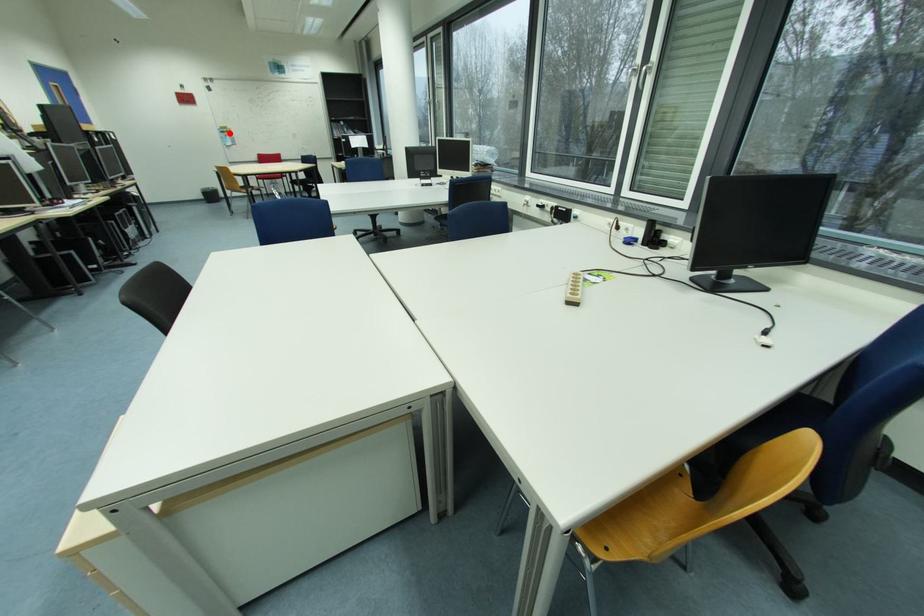
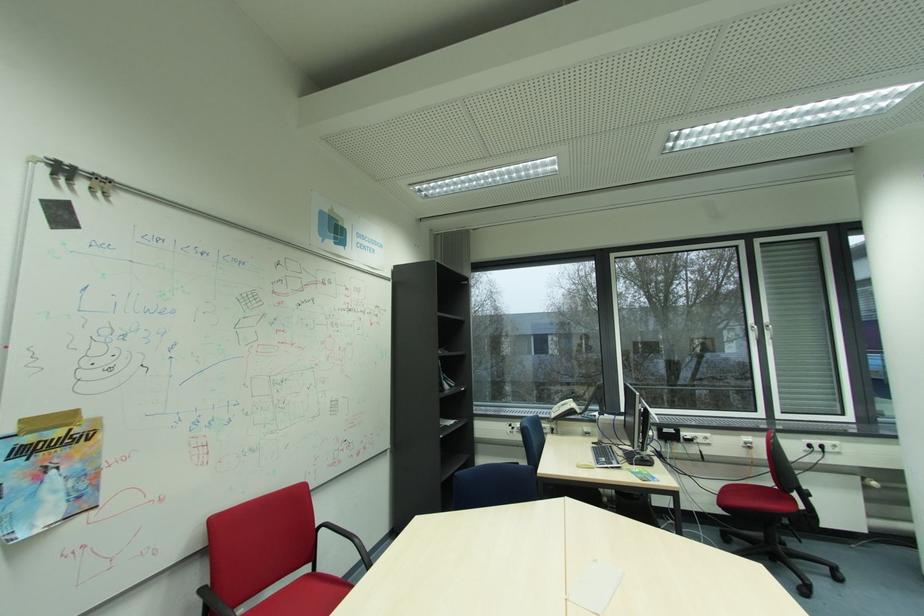
Locate, in the second image, the point that corresponds to the highlighted location in the first image.

(31, 452)